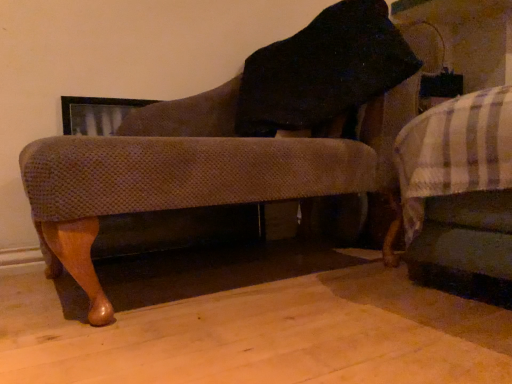
Measure the distance between textured fabric chair at center and camera.

textured fabric chair at center is 28.45 inches away from camera.

Describe the element at coordinates (234, 140) in the screenshot. I see `textured fabric chair at center` at that location.

Where is `textured fabric chair at center`? The width and height of the screenshot is (512, 384). textured fabric chair at center is located at coordinates (234, 140).

Image resolution: width=512 pixels, height=384 pixels. Describe the element at coordinates (460, 195) in the screenshot. I see `white striped fabric bed at right` at that location.

In order to click on white striped fabric bed at right in this screenshot , I will do coord(460,195).

You are a GUI agent. You are given a task and a screenshot of the screen. Output one action in this format:
    pyautogui.click(x=<x>, y=<y>)
    Task: Click on the textured fabric chair at center
    The width and height of the screenshot is (512, 384).
    Given the screenshot: What is the action you would take?
    pyautogui.click(x=234, y=140)

Consider the image. Would you say textured fabric chair at center is to the left or to the right of white striped fabric bed at right in the picture?

From the image, it's evident that textured fabric chair at center is to the left of white striped fabric bed at right.

Which is behind, textured fabric chair at center or white striped fabric bed at right?

Positioned behind is white striped fabric bed at right.

Does point (72, 263) appear closer or farther from the camera than point (405, 237)?

Point (72, 263) is positioned closer to the camera compared to point (405, 237).

From the image's perspective, relative to white striped fabric bed at right, is textured fabric chair at center above or below?

Based on their image positions, textured fabric chair at center is located above white striped fabric bed at right.

Looking at this image, from a real-world perspective, between textured fabric chair at center and white striped fabric bed at right, who is vertically higher?

textured fabric chair at center.

Considering the sizes of objects textured fabric chair at center and white striped fabric bed at right in the image provided, who is thinner, textured fabric chair at center or white striped fabric bed at right?

textured fabric chair at center.

Considering the sizes of objects textured fabric chair at center and white striped fabric bed at right in the image provided, who is shorter, textured fabric chair at center or white striped fabric bed at right?

white striped fabric bed at right is shorter.

Considering the relative sizes of textured fabric chair at center and white striped fabric bed at right in the image provided, is textured fabric chair at center bigger than white striped fabric bed at right?

Yes.

Is textured fabric chair at center positioned beyond the bounds of white striped fabric bed at right?

Yes, textured fabric chair at center is outside of white striped fabric bed at right.

Is textured fabric chair at center with white striped fabric bed at right?

No, textured fabric chair at center is not making contact with white striped fabric bed at right.

Is textured fabric chair at center facing away from white striped fabric bed at right?

No, textured fabric chair at center's orientation is not away from white striped fabric bed at right.

Can you tell me how much textured fabric chair at center and white striped fabric bed at right differ in facing direction?

The angle between the facing direction of textured fabric chair at center and the facing direction of white striped fabric bed at right is 84 degrees.

How far apart are textured fabric chair at center and white striped fabric bed at right?

The distance of textured fabric chair at center from white striped fabric bed at right is 30.51 centimeters.

The image size is (512, 384). There is a white striped fabric bed at right. In order to click on chair above it (from a real-world perspective) in this screenshot , I will do `click(234, 140)`.

Would you say white striped fabric bed at right is to the left or to the right of textured fabric chair at center in the picture?

white striped fabric bed at right is to the right of textured fabric chair at center.

Is white striped fabric bed at right closer to camera compared to textured fabric chair at center?

That is False.

Is point (509, 122) behind point (376, 74)?

No, it is in front of (376, 74).

From the image's perspective, is white striped fabric bed at right above textured fabric chair at center?

Incorrect, from the image's perspective, white striped fabric bed at right is lower than textured fabric chair at center.

From a real-world perspective, who is located lower, white striped fabric bed at right or textured fabric chair at center?

From a 3D spatial view, white striped fabric bed at right is below.

Which of these two, white striped fabric bed at right or textured fabric chair at center, is wider?

Wider between the two is white striped fabric bed at right.

Which of these two, white striped fabric bed at right or textured fabric chair at center, stands taller?

Standing taller between the two is textured fabric chair at center.

Is white striped fabric bed at right bigger than textured fabric chair at center?

No.

Could textured fabric chair at center be considered to be inside white striped fabric bed at right?

No, white striped fabric bed at right does not contain textured fabric chair at center.

Are white striped fabric bed at right and textured fabric chair at center making contact?

white striped fabric bed at right is not next to textured fabric chair at center, and they're not touching.

Looking at this image, could you tell me if white striped fabric bed at right is facing textured fabric chair at center?

No, white striped fabric bed at right does not turn towards textured fabric chair at center.

How far apart are white striped fabric bed at right and textured fabric chair at center?

12.01 inches.

Where is `furniture lying behind the textured fabric chair at center`? furniture lying behind the textured fabric chair at center is located at coordinates (460, 195).

Find the location of a particular element. The width and height of the screenshot is (512, 384). chair above the white striped fabric bed at right (from a real-world perspective) is located at coordinates (234, 140).

You are a GUI agent. You are given a task and a screenshot of the screen. Output one action in this format:
    pyautogui.click(x=<x>, y=<y>)
    Task: Click on the chair on the left of the white striped fabric bed at right
    
    Given the screenshot: What is the action you would take?
    pyautogui.click(x=234, y=140)